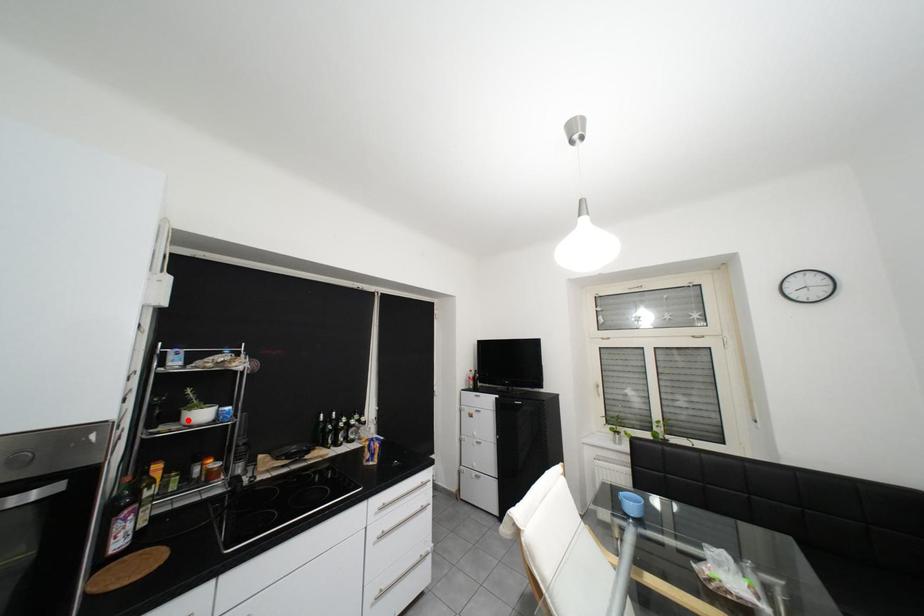
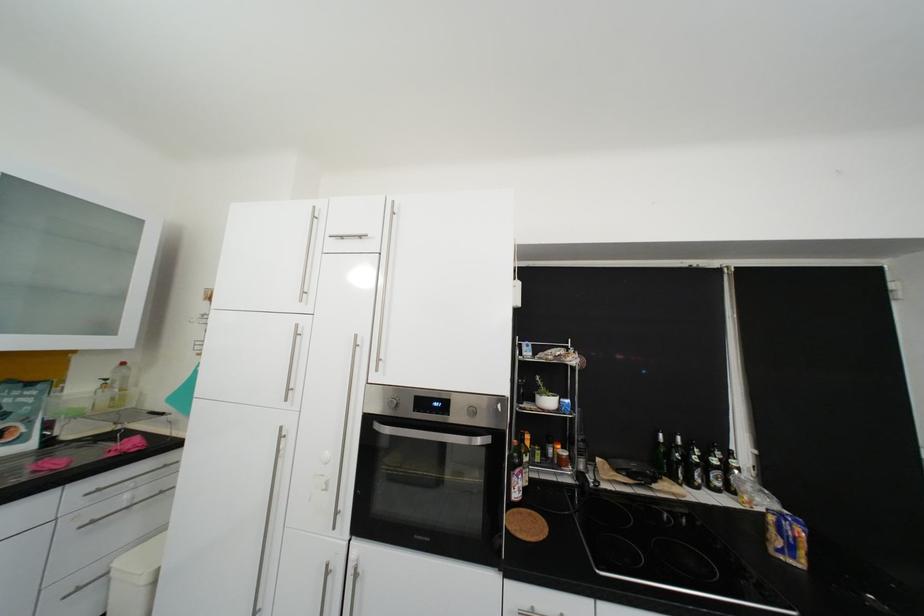
Question: I am providing you with two images of the same scene from different viewpoints. In image1, a red point is highlighted. Considering the same 3D point in image2, which of the following is correct?

Choices:
 (A) It is closer
 (B) It is farther

Answer: (B)